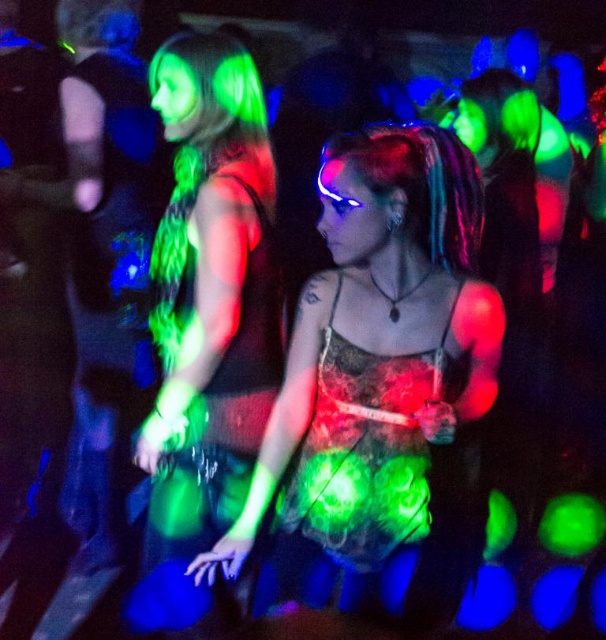
Based on the photo, is translucent lace top at center thinner than green fluorescent dress at left?

In fact, translucent lace top at center might be wider than green fluorescent dress at left.

Who is more forward, (344, 531) or (184, 509)?

Point (344, 531) is in front.

Is point (355, 538) behind point (235, 497)?

No, it is not.

This screenshot has height=640, width=606. Find the location of `translucent lace top at center`. translucent lace top at center is located at coordinates (381, 360).